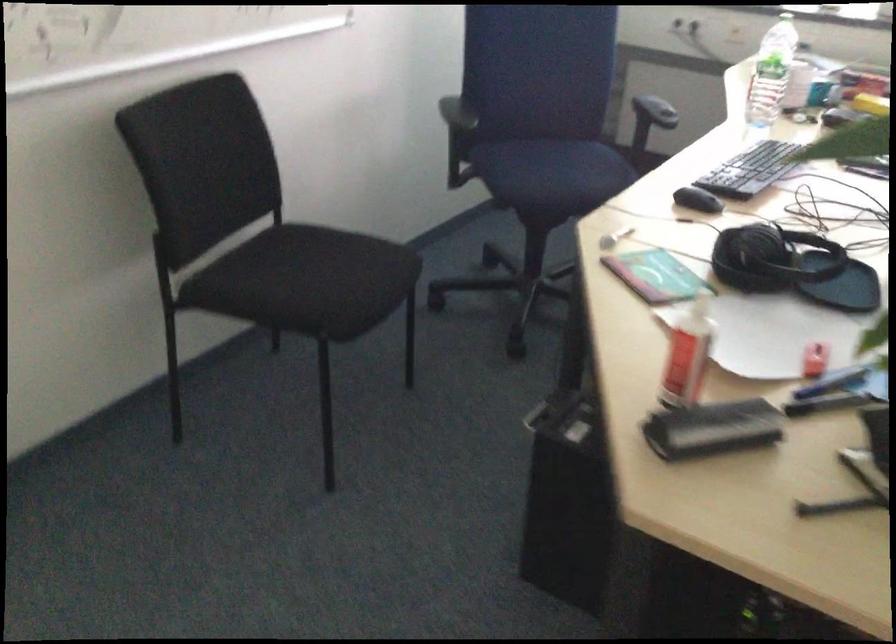
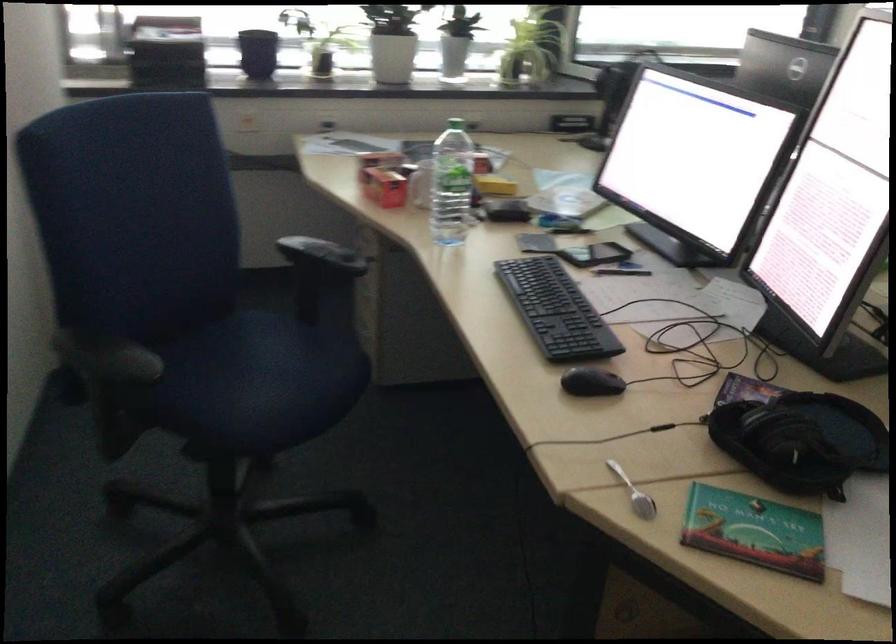
Find the pixel in the second image that matches pixel 645 279 in the first image.

(754, 531)